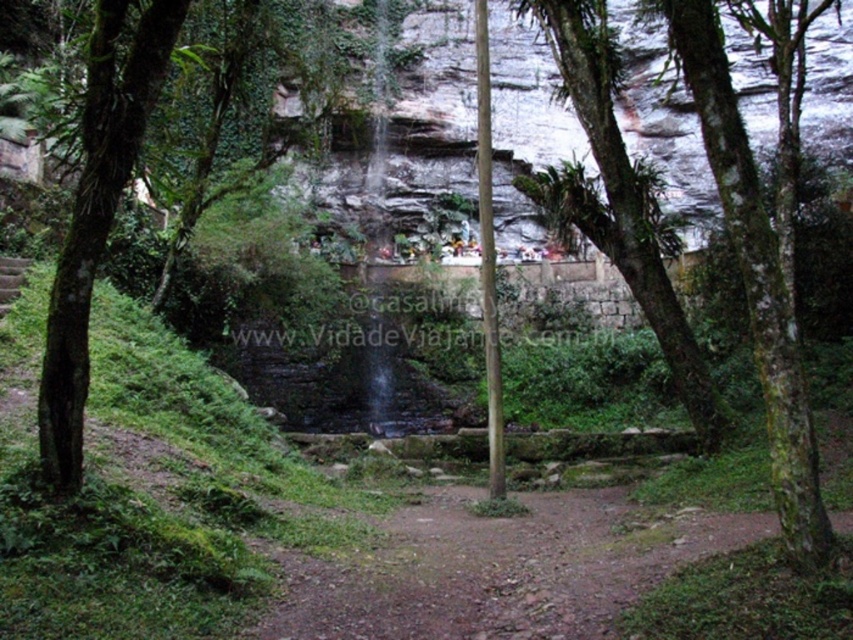
Question: Estimate the real-world distances between objects in this image. Which object is farther from the green mossy bark tree at center?

Choices:
 (A) green rough bark tree at left
 (B) brown dirt path at center

Answer: (A)

Question: Can you confirm if green rough bark tree at left is bigger than green mossy bark tree at center?

Choices:
 (A) no
 (B) yes

Answer: (A)

Question: Is brown dirt path at center behind green mossy tree at center?

Choices:
 (A) no
 (B) yes

Answer: (A)

Question: Which point is farther to the camera?

Choices:
 (A) (49, 372)
 (B) (454, 637)

Answer: (A)

Question: Is green mossy tree at center below green rough bark tree at left?

Choices:
 (A) no
 (B) yes

Answer: (A)

Question: Which point is closer to the camera taking this photo?

Choices:
 (A) (346, 579)
 (B) (61, 484)
 (C) (740, 237)

Answer: (C)